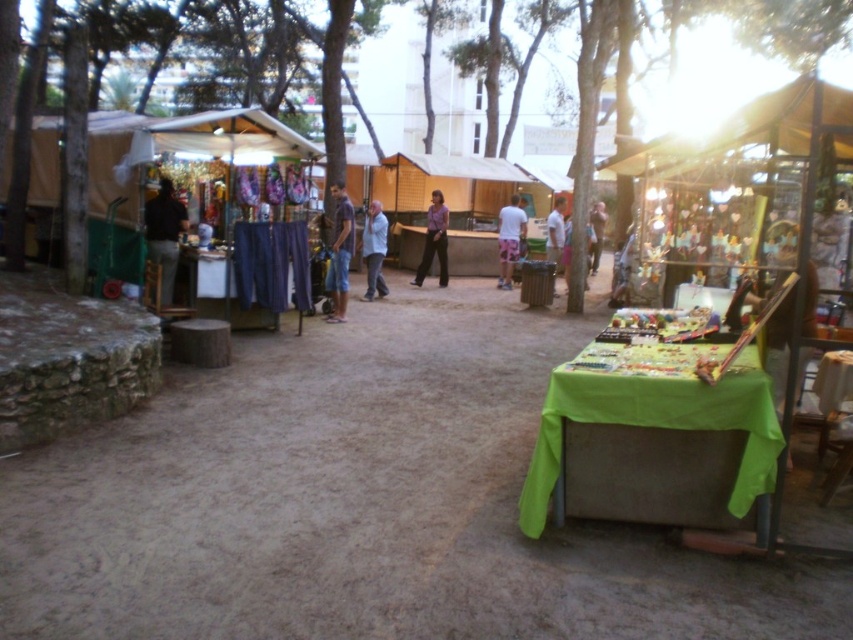
Which is more to the left, dark brown leather jacket at left or light brown leather jacket at center?

dark brown leather jacket at left

Can you confirm if dark brown leather jacket at left is smaller than light brown leather jacket at center?

Correct, dark brown leather jacket at left occupies less space than light brown leather jacket at center.

Locate an element on the screen. dark brown leather jacket at left is located at coordinates (164, 234).

Locate an element on the screen. The width and height of the screenshot is (853, 640). dark brown leather jacket at left is located at coordinates (164, 234).

Can you confirm if dark brown leather jacket at left is smaller than white cotton shirt at center?

Indeed, dark brown leather jacket at left has a smaller size compared to white cotton shirt at center.

Is dark brown leather jacket at left wider than white cotton shirt at center?

Incorrect, dark brown leather jacket at left's width does not surpass white cotton shirt at center's.

Is point (165, 276) positioned in front of point (502, 246)?

Yes, point (165, 276) is in front of point (502, 246).

Locate an element on the screen. The width and height of the screenshot is (853, 640). dark brown leather jacket at left is located at coordinates (164, 234).

Is point (432, 256) positioned before point (596, 225)?

Yes, it is.

The width and height of the screenshot is (853, 640). Identify the location of purple fabric pants at center. (434, 241).

This screenshot has width=853, height=640. What do you see at coordinates (434, 241) in the screenshot?
I see `purple fabric pants at center` at bounding box center [434, 241].

Identify the location of purple fabric pants at center. This screenshot has height=640, width=853. (434, 241).